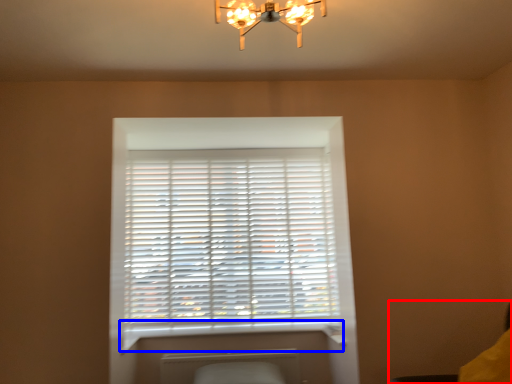
Question: Among these objects, which one is farthest to the camera, swivel chair (highlighted by a red box) or window sill (highlighted by a blue box)?

Choices:
 (A) swivel chair
 (B) window sill

Answer: (B)